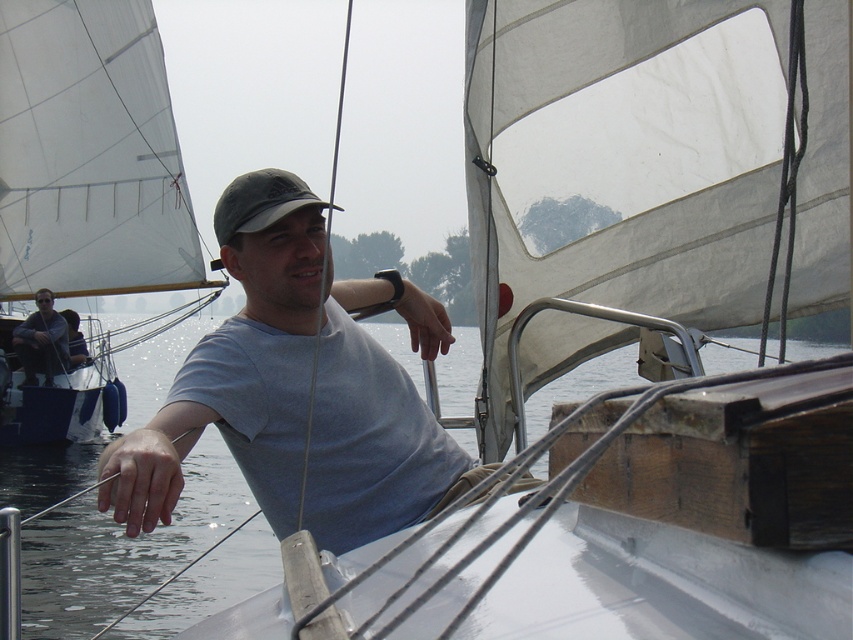
Question: Among these objects, which one is farthest from the camera?

Choices:
 (A) gray fabric baseball cap at center
 (B) white sail at left
 (C) matte black shirt at left

Answer: (B)

Question: Which point appears closest to the camera in this image?

Choices:
 (A) (0, 278)
 (B) (22, 355)
 (C) (202, 454)
 (D) (312, 529)

Answer: (D)

Question: Observing the image, what is the correct spatial positioning of white sail at left in reference to gray fabric baseball cap at center?

Choices:
 (A) left
 (B) right

Answer: (A)

Question: Is gray cotton t-shirt at center smaller than gray fabric baseball cap at center?

Choices:
 (A) yes
 (B) no

Answer: (B)

Question: Which of the following is the farthest from the observer?

Choices:
 (A) transparent water at center
 (B) gray cotton t-shirt at center

Answer: (A)

Question: Does gray fabric baseball cap at center appear on the right side of matte black shirt at left?

Choices:
 (A) yes
 (B) no

Answer: (A)